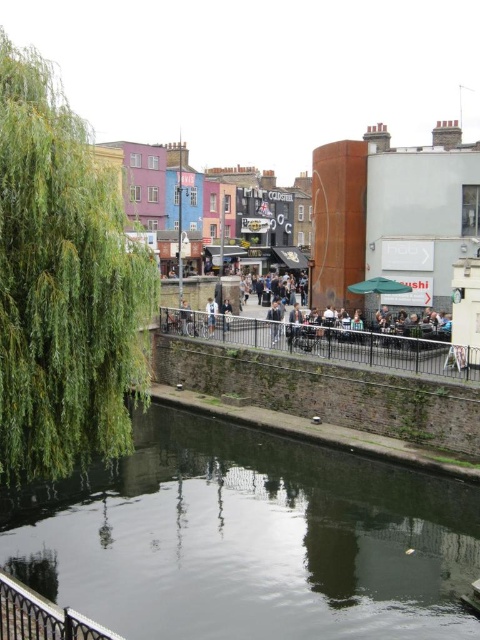
Who is higher up, dark reflective water at center or green leafy tree at left?

Positioned higher is green leafy tree at left.

Which is below, dark reflective water at center or green leafy tree at left?

dark reflective water at center

Who is more forward, (286, 593) or (117, 413)?

Point (286, 593)

The width and height of the screenshot is (480, 640). I want to click on dark reflective water at center, so click(248, 540).

Can you confirm if green leafy tree at left is wider than black metal rail at center?

No.

Can you confirm if green leafy tree at left is positioned above black metal rail at center?

Indeed, green leafy tree at left is positioned over black metal rail at center.

Does point (147, 288) lie in front of point (228, 316)?

Yes, point (147, 288) is in front of point (228, 316).

Locate an element on the screen. green leafy tree at left is located at coordinates (62, 285).

Consider the image. Can you confirm if black metal rail at center is wider than white fabric at center?

Yes.

Is black metal rail at center closer to camera compared to white fabric at center?

Yes, black metal rail at center is in front of white fabric at center.

Who is more forward, (408, 358) or (210, 316)?

Point (408, 358) is in front.

Where is `black metal rail at center`? This screenshot has height=640, width=480. black metal rail at center is located at coordinates [x=347, y=346].